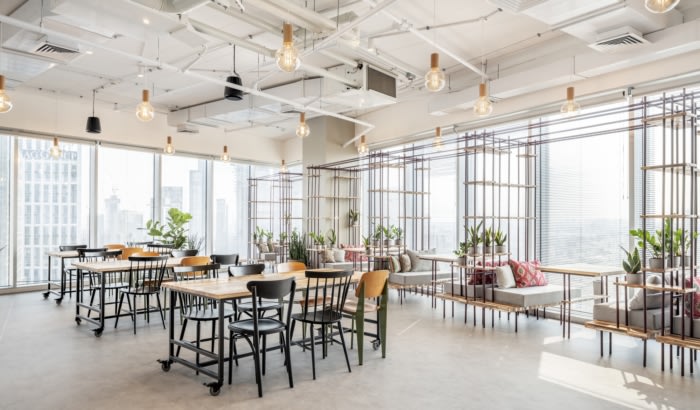
The image size is (700, 410). I want to click on chairs with light brown wood, so pyautogui.click(x=372, y=284), pyautogui.click(x=290, y=264), pyautogui.click(x=201, y=258), pyautogui.click(x=152, y=250), pyautogui.click(x=127, y=247), pyautogui.click(x=115, y=244).